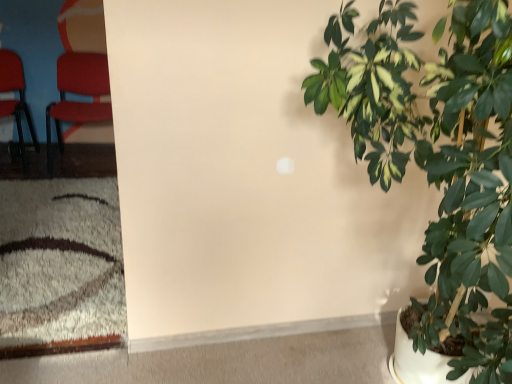
What is the approximate width of matte red chair at left, which ranks as the first chair in left-to-right order?

21.05 inches.

At what (x,y) coordinates should I click in order to perform the action: click on matte red chair at left, which ranks as the first chair in left-to-right order. Please return your answer as a coordinate pair (x, y). Looking at the image, I should click on (15, 99).

Find the location of a particular element. matte red chair at left, the first chair when ordered from right to left is located at coordinates (80, 71).

At what (x,y) coordinates should I click in order to perform the action: click on green glossy leafy plant at right. Please return your answer as a coordinate pair (x, y). This screenshot has width=512, height=384. Looking at the image, I should click on (439, 157).

How far apart are green glossy leafy plant at right and white matte carpet at lower left?

The distance of green glossy leafy plant at right from white matte carpet at lower left is 1.02 meters.

Is green glossy leafy plant at right far from white matte carpet at lower left?

That's right, there is a large distance between green glossy leafy plant at right and white matte carpet at lower left.

How different are the orientations of green glossy leafy plant at right and white matte carpet at lower left in degrees?

There is a 179-degree angle between the facing directions of green glossy leafy plant at right and white matte carpet at lower left.

Which of these two, green glossy leafy plant at right or white matte carpet at lower left, is bigger?

With larger size is green glossy leafy plant at right.

Based on their positions, is matte red chair at left, the first chair when ordered from right to left, located to the left or right of matte red chair at left, which ranks as the first chair in left-to-right order?

From the image, it's evident that matte red chair at left, the first chair when ordered from right to left, is to the right of matte red chair at left, which ranks as the first chair in left-to-right order.

Considering the relative sizes of matte red chair at left, the first chair when ordered from right to left, and matte red chair at left, marked as the 2th chair in a right-to-left arrangement, in the image provided, is matte red chair at left, the first chair when ordered from right to left, taller than matte red chair at left, marked as the 2th chair in a right-to-left arrangement,?

In fact, matte red chair at left, the first chair when ordered from right to left, may be shorter than matte red chair at left, marked as the 2th chair in a right-to-left arrangement.

From the image's perspective, is matte red chair at left, the first chair when ordered from right to left, positioned above or below matte red chair at left, which ranks as the first chair in left-to-right order?

matte red chair at left, the first chair when ordered from right to left, is below matte red chair at left, which ranks as the first chair in left-to-right order.

Is matte red chair at left, the 2th chair from the left, outside of white matte carpet at lower left?

Absolutely, matte red chair at left, the 2th chair from the left, is external to white matte carpet at lower left.

Considering the sizes of objects matte red chair at left, the first chair when ordered from right to left, and white matte carpet at lower left in the image provided, who is wider, matte red chair at left, the first chair when ordered from right to left, or white matte carpet at lower left?

white matte carpet at lower left.

Is matte red chair at left, the 2th chair from the left, at the left side of green glossy leafy plant at right?

Correct, you'll find matte red chair at left, the 2th chair from the left, to the left of green glossy leafy plant at right.

Could green glossy leafy plant at right be considered to be inside matte red chair at left, the 2th chair from the left?

No, green glossy leafy plant at right is located outside of matte red chair at left, the 2th chair from the left.

Is matte red chair at left, the first chair when ordered from right to left, looking in the opposite direction of green glossy leafy plant at right?

No, matte red chair at left, the first chair when ordered from right to left, is not facing away from green glossy leafy plant at right.

Does matte red chair at left, the 2th chair from the left, touch green glossy leafy plant at right?

No, matte red chair at left, the 2th chair from the left, is not touching green glossy leafy plant at right.

Does white matte carpet at lower left contain matte red chair at left, marked as the 2th chair in a right-to-left arrangement?

Definitely not — matte red chair at left, marked as the 2th chair in a right-to-left arrangement, is not inside white matte carpet at lower left.

How many degrees apart are the facing directions of white matte carpet at lower left and matte red chair at left, marked as the 2th chair in a right-to-left arrangement?

The angle between the facing direction of white matte carpet at lower left and the facing direction of matte red chair at left, marked as the 2th chair in a right-to-left arrangement, is 82.6 degrees.

Between point (169, 381) and point (6, 62), which one is positioned in front?

The point (169, 381) is more forward.

How many degrees apart are the facing directions of matte red chair at left, marked as the 2th chair in a right-to-left arrangement, and green glossy leafy plant at right?

They differ by 96.2 degrees in their facing directions.

Is matte red chair at left, which ranks as the first chair in left-to-right order, completely or partially outside of green glossy leafy plant at right?

Yes, matte red chair at left, which ranks as the first chair in left-to-right order, is located beyond the bounds of green glossy leafy plant at right.

Does matte red chair at left, marked as the 2th chair in a right-to-left arrangement, have a lesser width compared to green glossy leafy plant at right?

Indeed, matte red chair at left, marked as the 2th chair in a right-to-left arrangement, has a lesser width compared to green glossy leafy plant at right.

Is point (20, 150) less distant than point (341, 63)?

No, (20, 150) is behind (341, 63).

From the image's perspective, which is above, white matte carpet at lower left or matte red chair at left, the first chair when ordered from right to left?

From the image's view, matte red chair at left, the first chair when ordered from right to left, is above.

The image size is (512, 384). What are the coordinates of `concrete on the right of matte red chair at left, the first chair when ordered from right to left` in the screenshot? It's located at (231, 357).

From a real-world perspective, does white matte carpet at lower left sit lower than matte red chair at left, the 2th chair from the left?

Yes, from a real-world perspective, white matte carpet at lower left is beneath matte red chair at left, the 2th chair from the left.

Can matte red chair at left, the 2th chair from the left, be found inside white matte carpet at lower left?

No, matte red chair at left, the 2th chair from the left, is not surrounded by white matte carpet at lower left.

You are a GUI agent. You are given a task and a screenshot of the screen. Output one action in this format:
    pyautogui.click(x=<x>, y=<y>)
    Task: Click on the concrete below the green glossy leafy plant at right (from the image's perspective)
    The image size is (512, 384).
    Given the screenshot: What is the action you would take?
    pyautogui.click(x=231, y=357)

I want to click on chair above the matte red chair at left, the 2th chair from the left (from a real-world perspective), so click(x=15, y=99).

From the image, which object appears to be farther from matte red chair at left, which ranks as the first chair in left-to-right order, white matte carpet at lower left or matte red chair at left, the first chair when ordered from right to left?

Among the two, white matte carpet at lower left is located further to matte red chair at left, which ranks as the first chair in left-to-right order.

Considering their positions, is green glossy leafy plant at right positioned further to matte red chair at left, the 2th chair from the left, than matte red chair at left, which ranks as the first chair in left-to-right order?

green glossy leafy plant at right lies further to matte red chair at left, the 2th chair from the left, than the other object.

From the image, which object appears to be nearer to matte red chair at left, the first chair when ordered from right to left, green glossy leafy plant at right or white matte carpet at lower left?

white matte carpet at lower left is positioned closer to the anchor matte red chair at left, the first chair when ordered from right to left.

Looking at the image, which one is located further to white matte carpet at lower left, matte red chair at left, which ranks as the first chair in left-to-right order, or green glossy leafy plant at right?

matte red chair at left, which ranks as the first chair in left-to-right order, is positioned further to the anchor white matte carpet at lower left.

When comparing their distances from matte red chair at left, the 2th chair from the left, does white matte carpet at lower left or green glossy leafy plant at right seem further?

green glossy leafy plant at right is further to matte red chair at left, the 2th chair from the left.

Considering their positions, is matte red chair at left, the 2th chair from the left, positioned further to matte red chair at left, marked as the 2th chair in a right-to-left arrangement, than white matte carpet at lower left?

Among the two, white matte carpet at lower left is located further to matte red chair at left, marked as the 2th chair in a right-to-left arrangement.

From the image, which object appears to be nearer to white matte carpet at lower left, matte red chair at left, the 2th chair from the left, or matte red chair at left, which ranks as the first chair in left-to-right order?

matte red chair at left, the 2th chair from the left.

Considering their positions, is green glossy leafy plant at right positioned closer to matte red chair at left, marked as the 2th chair in a right-to-left arrangement, than matte red chair at left, the 2th chair from the left?

matte red chair at left, the 2th chair from the left, is closer to matte red chair at left, marked as the 2th chair in a right-to-left arrangement.

The width and height of the screenshot is (512, 384). Find the location of `concrete located between green glossy leafy plant at right and matte red chair at left, the 2th chair from the left, in the depth direction`. concrete located between green glossy leafy plant at right and matte red chair at left, the 2th chair from the left, in the depth direction is located at coordinates (231, 357).

At what (x,y) coordinates should I click in order to perform the action: click on concrete located between matte red chair at left, marked as the 2th chair in a right-to-left arrangement, and green glossy leafy plant at right in the left-right direction. Please return your answer as a coordinate pair (x, y). This screenshot has width=512, height=384. Looking at the image, I should click on pos(231,357).

Identify the location of chair located between green glossy leafy plant at right and matte red chair at left, the 2th chair from the left, in the depth direction. (15, 99).

I want to click on chair between matte red chair at left, which ranks as the first chair in left-to-right order, and white matte carpet at lower left, so click(x=80, y=71).